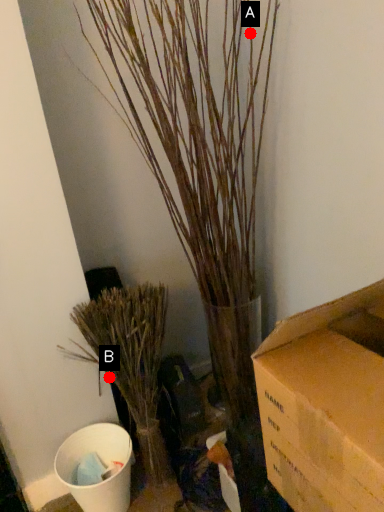
Question: Two points are circled on the image, labeled by A and B beside each circle. Which of the following is the closest to the observer?

Choices:
 (A) A is closer
 (B) B is closer

Answer: (A)